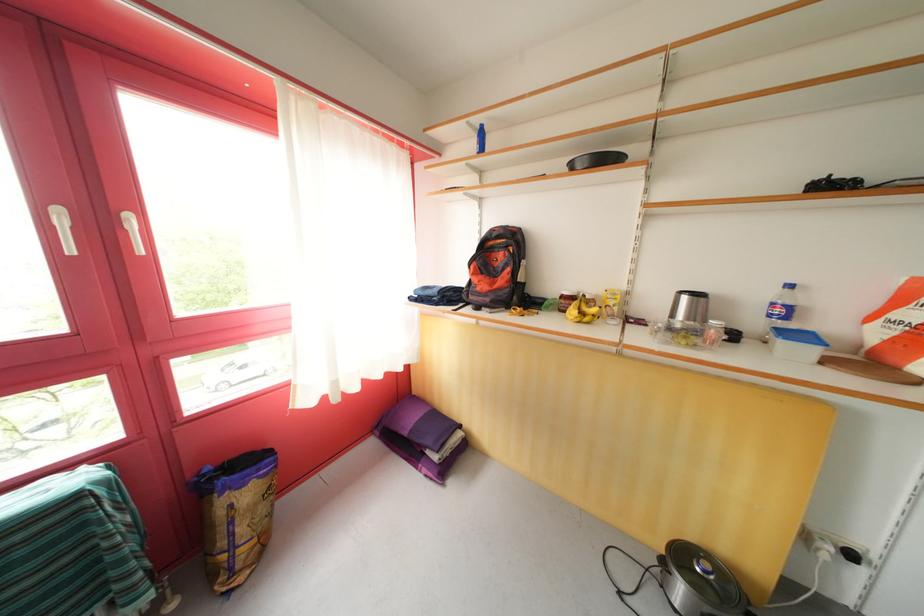
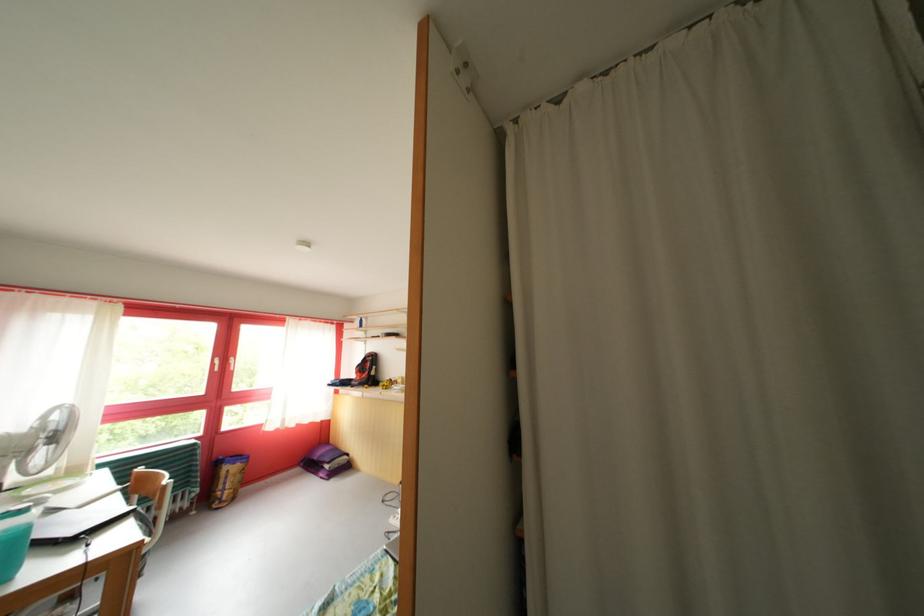
Which direction would the cameraman need to move to produce the second image?

The movement direction of the cameraman is right, backward.